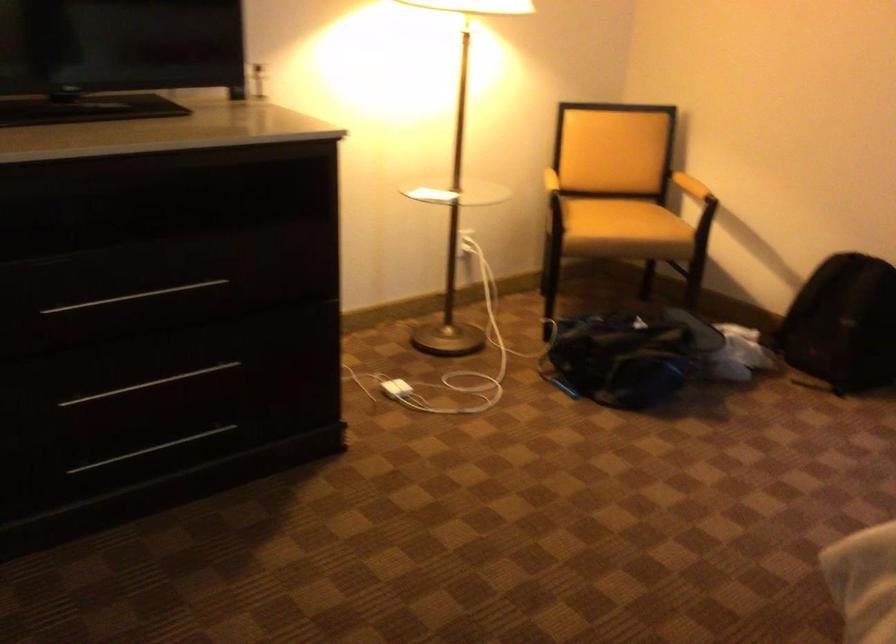
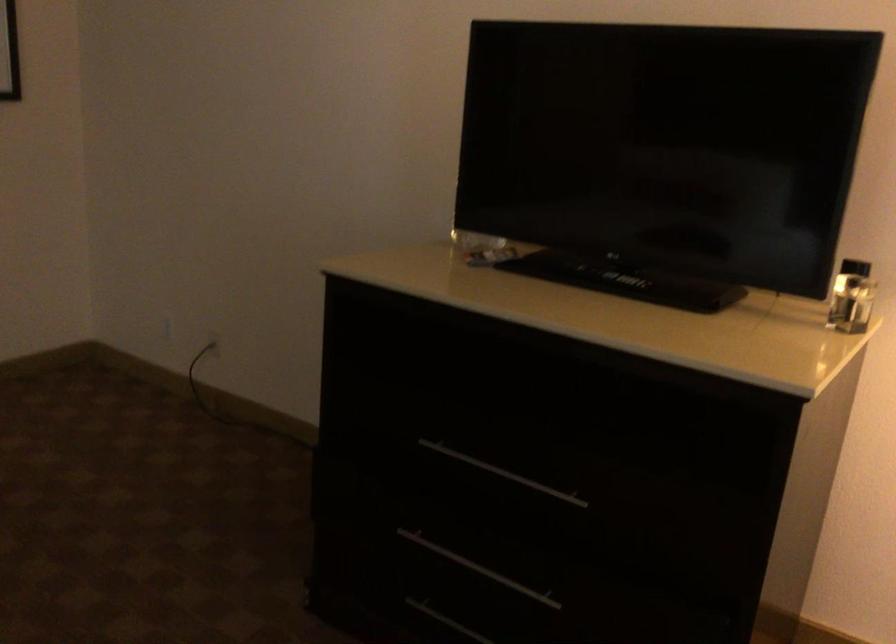
The point at (x=110, y=301) is marked in the first image. Where is the corresponding point in the second image?

(502, 473)